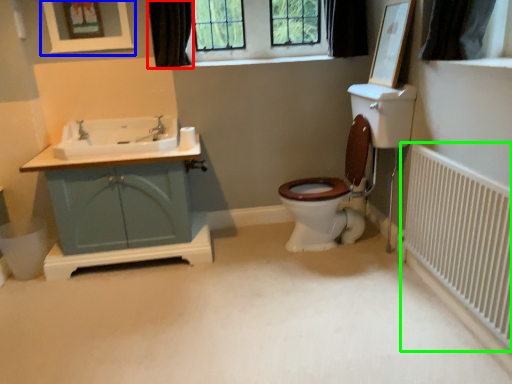
Question: Based on their relative distances, which object is farther from curtain (highlighted by a red box)? Choose from picture frame (highlighted by a blue box) and radiator (highlighted by a green box).

Choices:
 (A) picture frame
 (B) radiator

Answer: (B)